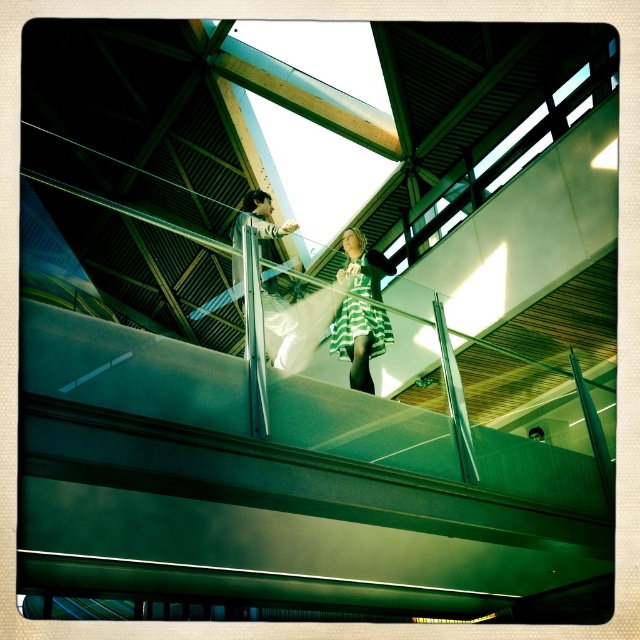
Question: Which point is farther from the camera taking this photo?

Choices:
 (A) (333, 310)
 (B) (360, 272)

Answer: (B)

Question: Is striped jersey dress at center bigger than green striped dress at center?

Choices:
 (A) yes
 (B) no

Answer: (A)

Question: Which object appears farthest from the camera in this image?

Choices:
 (A) green striped dress at center
 (B) striped jersey dress at center

Answer: (A)

Question: Considering the relative positions of striped jersey dress at center and green striped dress at center in the image provided, where is striped jersey dress at center located with respect to green striped dress at center?

Choices:
 (A) below
 (B) above

Answer: (B)

Question: Is striped jersey dress at center wider than green striped dress at center?

Choices:
 (A) no
 (B) yes

Answer: (B)

Question: Which of the following is the closest to the observer?

Choices:
 (A) (276, 360)
 (B) (344, 252)

Answer: (A)